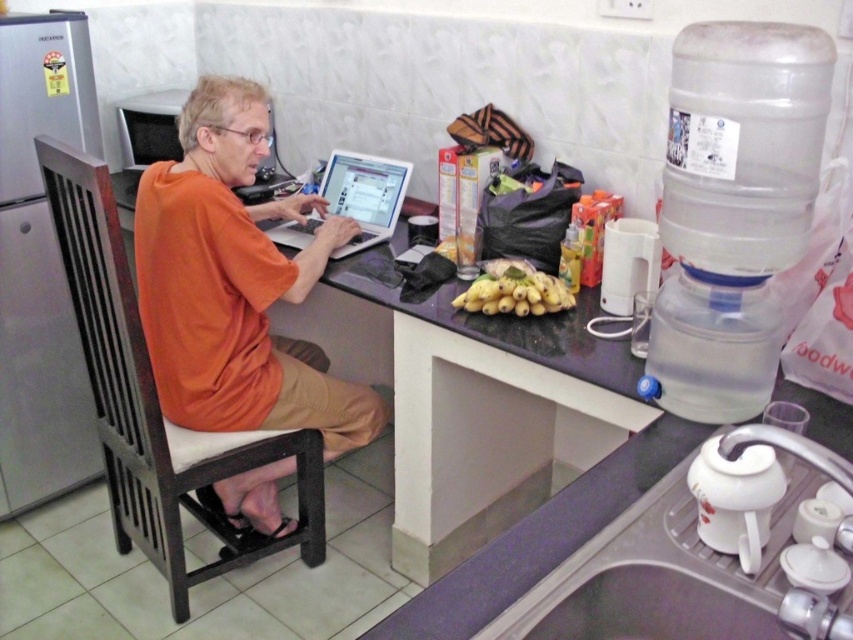
You are a person who needs to place a heavy object on a surface. Considering the purple laminate counter at center and the brown wood chair at left, which surface would be more suitable for placing the heavy object?

The purple laminate counter at center is more suitable for placing the heavy object because it has a lesser height compared to the brown wood chair at left, making it a more stable and appropriate surface for heavy items.

In the scene shown: You are standing in the kitchen and want to reach the silver metallic laptop at center. Which object is directly in front of you at the point marked by coordinates [364,195]?

The point at coordinates [364,195] corresponds to the silver metallic laptop at center, so that is directly in front of you.

You are a person who is 6 feet tall and standing in front of the purple laminate counter at center. Can you comfortably reach the items placed on it without needing a stool?

The purple laminate counter at center is 37.26 inches away from the viewer. Since the average comfortable reach for a 6 foot tall person is typically around 24 to 30 inches, the distance here is beyond that range. Therefore, you would likely need a stool or step to comfortably reach the items on the counter.